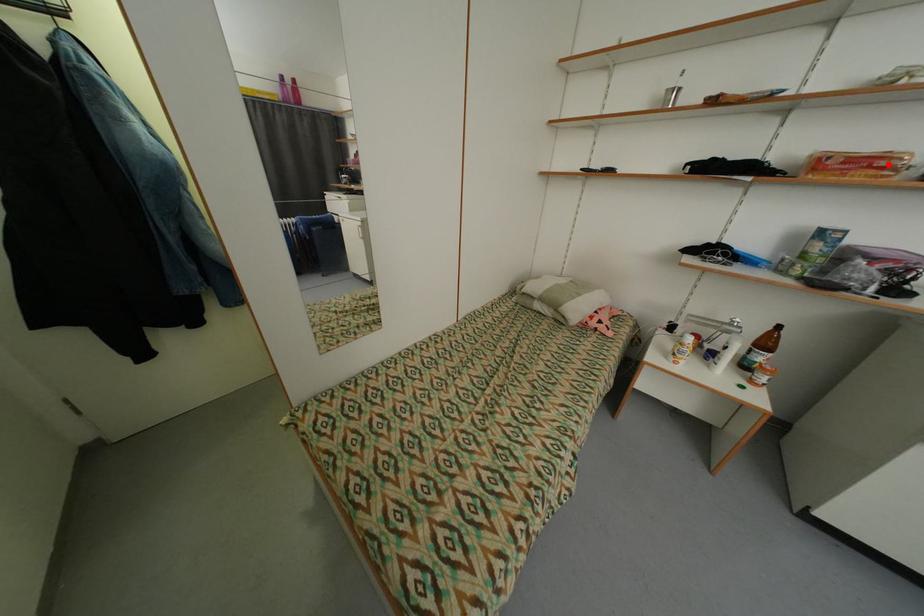
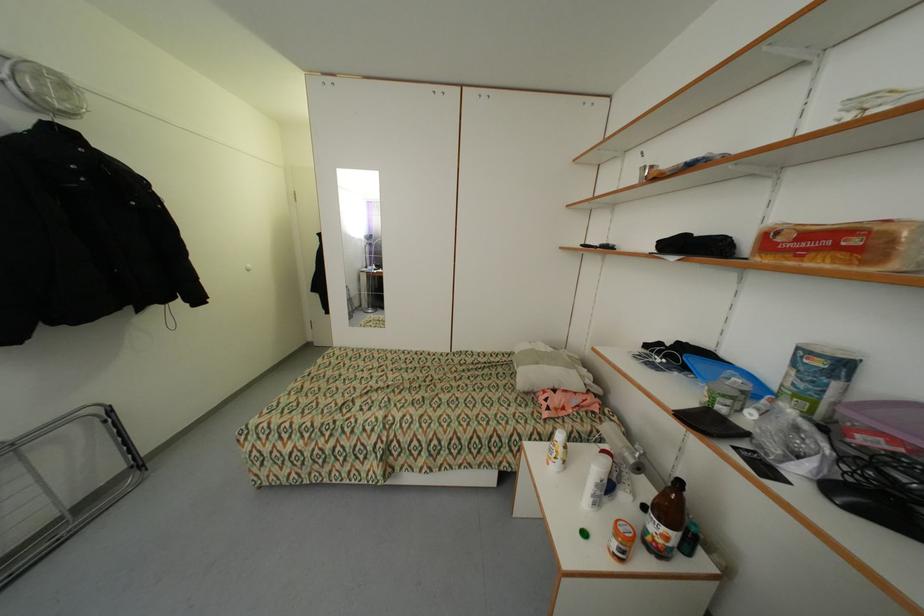
Question: I am providing you with two images of the same scene from different viewpoints. Image1 has a red point marked. In image2, the corresponding 3D location appears at what relative position? Reply with the corresponding letter.

Choices:
 (A) Closer
 (B) Farther

Answer: (A)